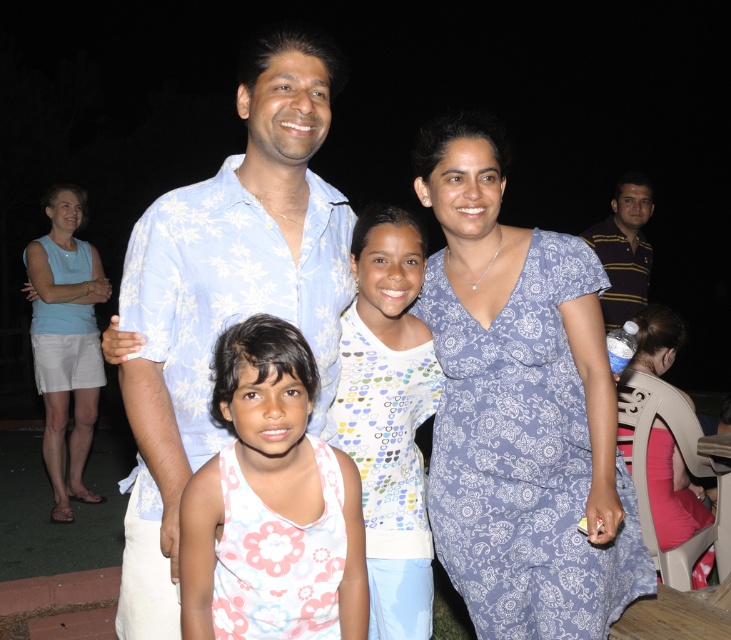
Question: Which of these objects is positioned closest to the light blue fabric skirt at lower left?

Choices:
 (A) floral tank top at center
 (B) white dotted shirt at center
 (C) light blue floral shirt at center
 (D) striped polo shirt at right

Answer: (C)

Question: Which object is farther from the camera taking this photo?

Choices:
 (A) floral tank top at center
 (B) blue paisley dress at center
 (C) striped polo shirt at right
 (D) white dotted shirt at center

Answer: (C)

Question: Does floral tank top at center have a lesser width compared to light blue fabric skirt at lower left?

Choices:
 (A) no
 (B) yes

Answer: (B)

Question: Is blue paisley dress at center smaller than white dotted shirt at center?

Choices:
 (A) no
 (B) yes

Answer: (A)

Question: Which object appears closest to the camera in this image?

Choices:
 (A) blue paisley dress at center
 (B) striped polo shirt at right

Answer: (A)

Question: Is light blue floral shirt at center smaller than light blue fabric skirt at lower left?

Choices:
 (A) yes
 (B) no

Answer: (A)